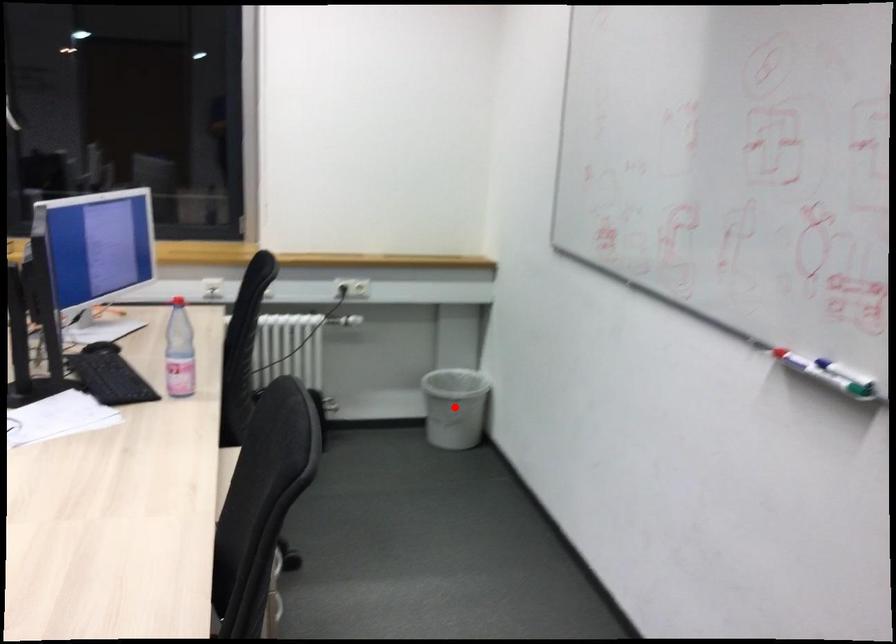
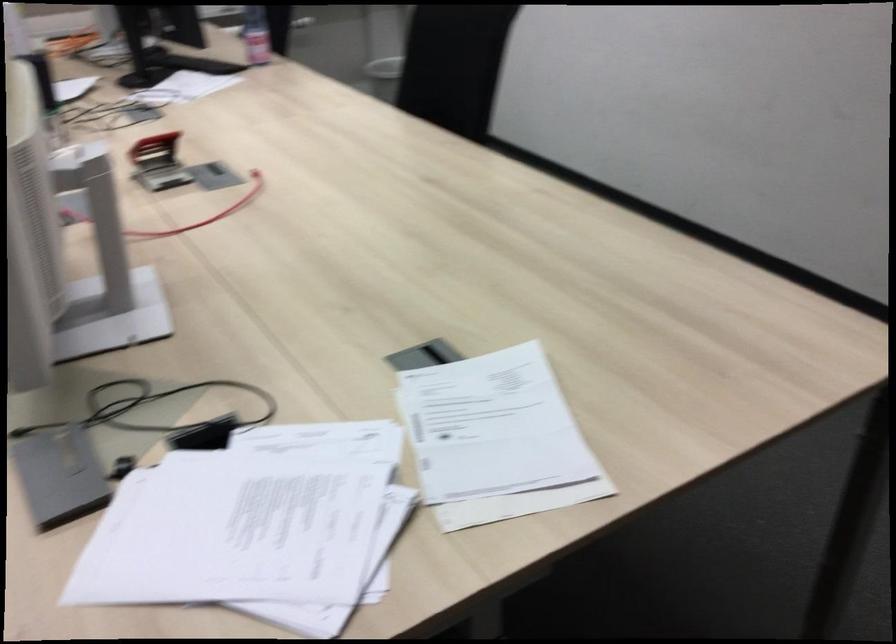
Question: I am providing you with two images of the same scene from different viewpoints. A red point is marked on the first image. At the location where the point appears in image 1, is it still visible in image 2?

Choices:
 (A) Yes
 (B) No

Answer: (B)